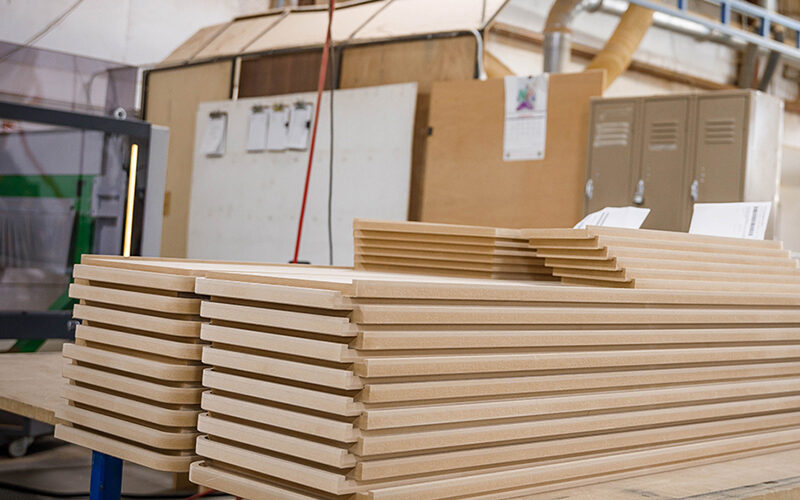
You are a GUI agent. You are given a task and a screenshot of the screen. Output one action in this format:
    pyautogui.click(x=<x>, y=<y>)
    Task: Click on the wall
    
    Given the screenshot: What is the action you would take?
    pyautogui.click(x=625, y=85), pyautogui.click(x=518, y=59), pyautogui.click(x=157, y=35)